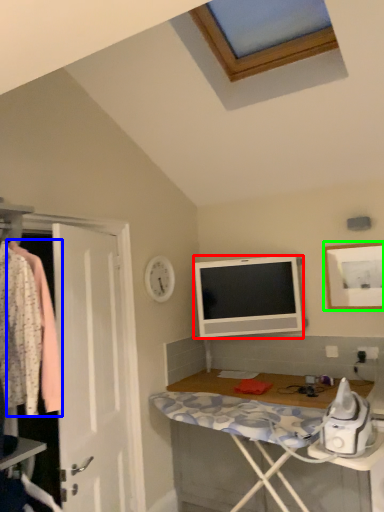
Question: Which object is positioned closest to television (highlighted by a red box)? Select from clothing (highlighted by a blue box) and picture frame (highlighted by a green box).

Choices:
 (A) clothing
 (B) picture frame

Answer: (B)